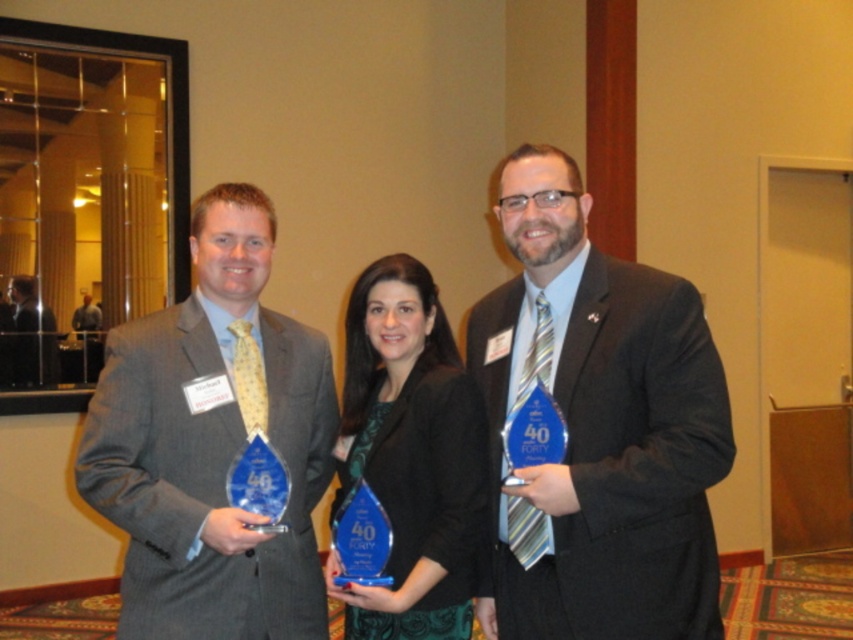
Is matte gray suit at center above matte black suit at left?

Actually, matte gray suit at center is below matte black suit at left.

Looking at this image, who is more forward, (x=204, y=330) or (x=50, y=310)?

Point (x=204, y=330) is more forward.

The image size is (853, 640). What are the coordinates of `matte gray suit at center` in the screenshot? It's located at (212, 444).

Does point (589, 292) come in front of point (374, 278)?

That is True.

Is point (659, 356) farther from viewer compared to point (389, 428)?

No, (659, 356) is in front of (389, 428).

You are a GUI agent. You are given a task and a screenshot of the screen. Output one action in this format:
    pyautogui.click(x=<x>, y=<y>)
    Task: Click on the matte black suit at center
    This screenshot has width=853, height=640.
    Given the screenshot: What is the action you would take?
    pyautogui.click(x=599, y=426)

Consider the image. Which is below, matte black suit at center or matte black suit at left?

matte black suit at center

Where is `matte black suit at center`? Image resolution: width=853 pixels, height=640 pixels. matte black suit at center is located at coordinates (599, 426).